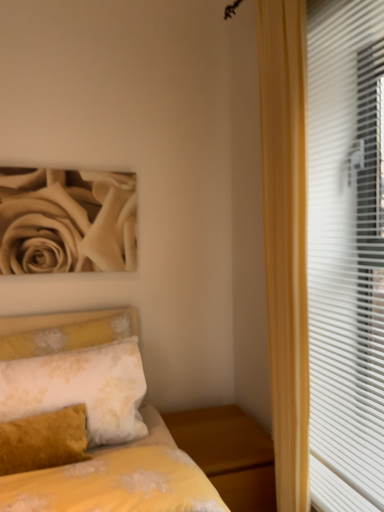
At what (x,y) coordinates should I click in order to perform the action: click on free space above beige matte rose at upper left (from a real-world perspective). Please return your answer as a coordinate pair (x, y). Looking at the image, I should click on (62, 163).